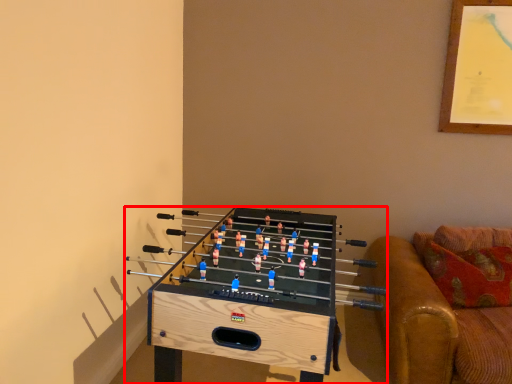
Question: Where is furniture (annotated by the red box) located in relation to studio couch in the image?

Choices:
 (A) left
 (B) right

Answer: (A)